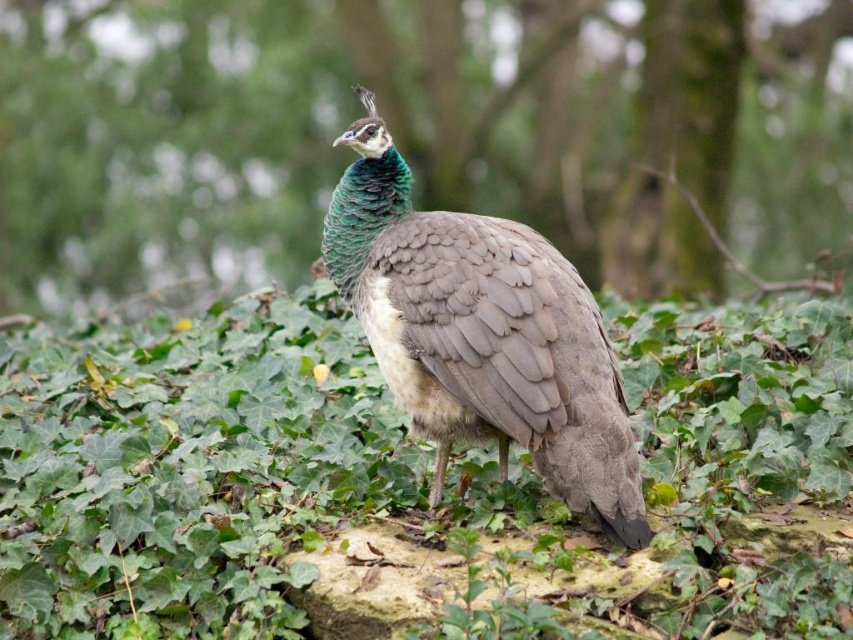
Question: Which point appears farthest from the camera in this image?

Choices:
 (A) (339, 166)
 (B) (352, 236)
 (C) (51, 500)

Answer: (A)

Question: Does green leafy tree at center have a greater width compared to green leafy grass at center?

Choices:
 (A) yes
 (B) no

Answer: (A)

Question: Is green leafy grass at center closer to the viewer compared to shiny green peacock at center?

Choices:
 (A) no
 (B) yes

Answer: (A)

Question: Which object is closer to the camera taking this photo?

Choices:
 (A) green leafy grass at center
 (B) green leafy tree at center

Answer: (A)

Question: Is green leafy tree at center positioned behind green leafy grass at center?

Choices:
 (A) yes
 (B) no

Answer: (A)

Question: Among these objects, which one is nearest to the camera?

Choices:
 (A) shiny green peacock at center
 (B) green leafy tree at center
 (C) green leafy grass at center

Answer: (A)